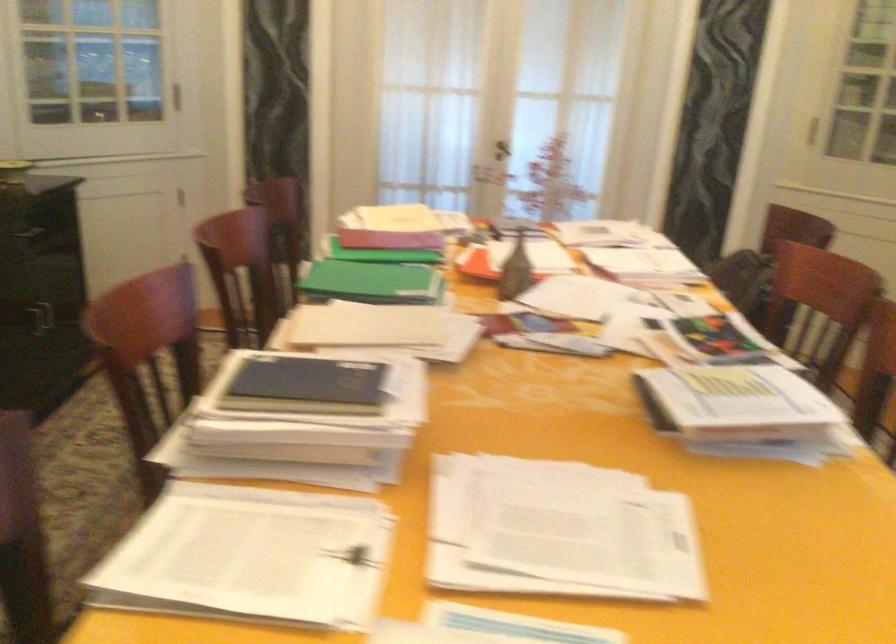
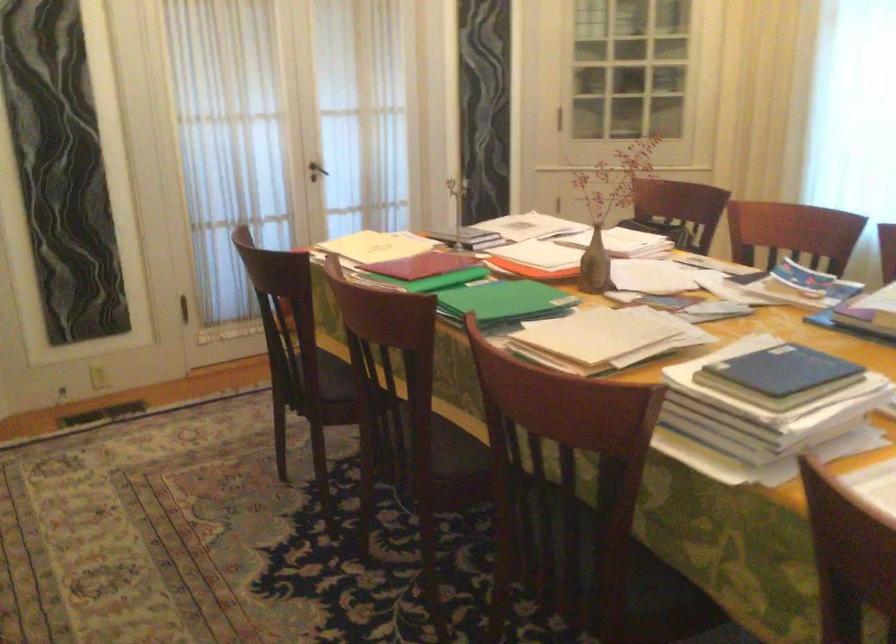
Where in the second image is the point corresponding to the point at 520,275 from the first image?

(595, 265)